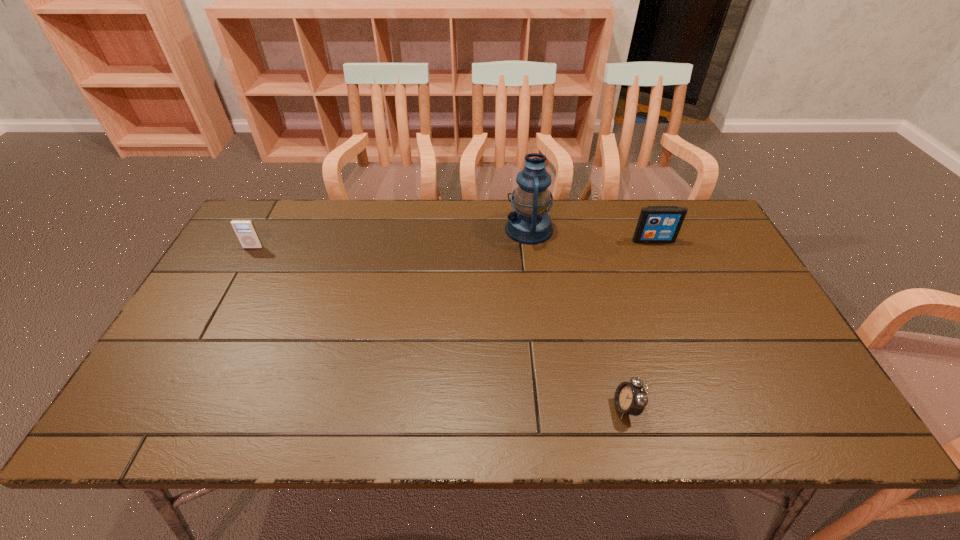
Where is `vacant space that's between the third shortest object and the shorter iPod`? vacant space that's between the third shortest object and the shorter iPod is located at coordinates (453, 244).

The image size is (960, 540). I want to click on free spot between the second object from left to right and the taller iPod, so click(x=591, y=234).

This screenshot has height=540, width=960. Find the location of `free spot between the left iPod and the second object from right to left`. free spot between the left iPod and the second object from right to left is located at coordinates (440, 327).

I want to click on unoccupied area between the rightmost object and the alarm clock, so click(639, 324).

Find the location of a particular element. The height and width of the screenshot is (540, 960). vacant space that is in between the second tallest object and the lantern is located at coordinates (591, 234).

Find the location of a particular element. This screenshot has height=540, width=960. empty space that is in between the right iPod and the tallest object is located at coordinates [591, 234].

Locate an element on the screen. object that stands as the second closest to the nearer iPod is located at coordinates (630, 398).

Identify which object is the third closest to the second object from left to right. Please provide its 2D coordinates. Your answer should be formatted as a tuple, i.e. [(x, y)], where the tuple contains the x and y coordinates of a point satisfying the conditions above.

[(245, 230)]

Locate an element on the screen. This screenshot has width=960, height=540. vacant space that satisfies the following two spatial constraints: 1. on the face of the lantern; 2. on the front-facing side of the nearer iPod is located at coordinates (531, 247).

Where is `free spot that satisfies the following two spatial constraints: 1. on the face of the tallest object; 2. on the front-facing side of the leftmost object`? The width and height of the screenshot is (960, 540). free spot that satisfies the following two spatial constraints: 1. on the face of the tallest object; 2. on the front-facing side of the leftmost object is located at coordinates (531, 247).